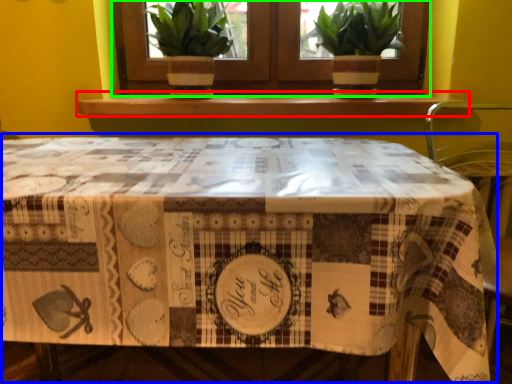
Question: Considering the real-world distances, which object is farthest from window sill (highlighted by a red box)? table (highlighted by a blue box) or window (highlighted by a green box)?

Choices:
 (A) table
 (B) window

Answer: (A)